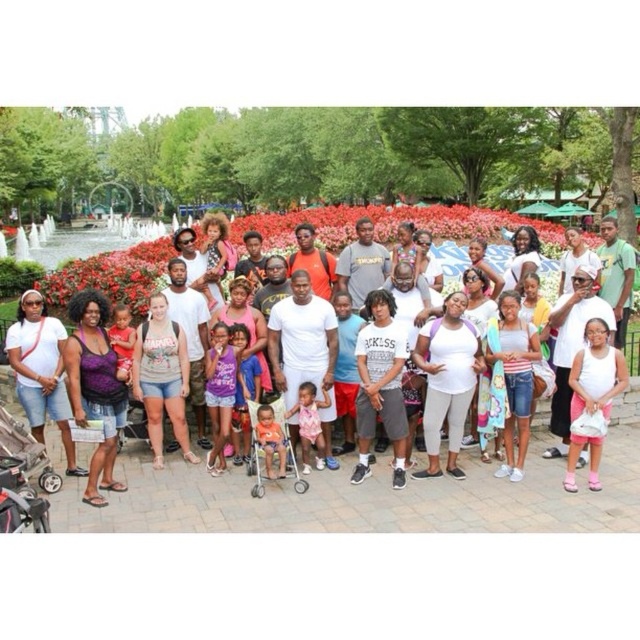
Question: Estimate the real-world distances between objects in this image. Which object is farther from the silver metallic stroller at center?

Choices:
 (A) black plastic baby carriage at lower left
 (B) green cotton shirt at center
 (C) white cotton t-shirt at center

Answer: (C)

Question: Considering the relative positions of white cotton t-shirt at center and white matte shirt at center in the image provided, where is white cotton t-shirt at center located with respect to white matte shirt at center?

Choices:
 (A) above
 (B) below

Answer: (A)

Question: Is silver metallic stroller at center further to camera compared to green cotton shirt at center?

Choices:
 (A) yes
 (B) no

Answer: (B)

Question: Is silver metallic stroller at center smaller than green cotton shirt at center?

Choices:
 (A) yes
 (B) no

Answer: (A)

Question: Which object is farther from the camera taking this photo?

Choices:
 (A) black plastic baby carriage at lower left
 (B) white matte shirt at center
 (C) green cotton shirt at center
 (D) silver metallic stroller at center

Answer: (B)

Question: Which point is closer to the camera?

Choices:
 (A) white cotton t-shirt at center
 (B) white matte shirt at center
 (C) silver metallic stroller at center
 (D) green cotton shirt at center

Answer: (C)